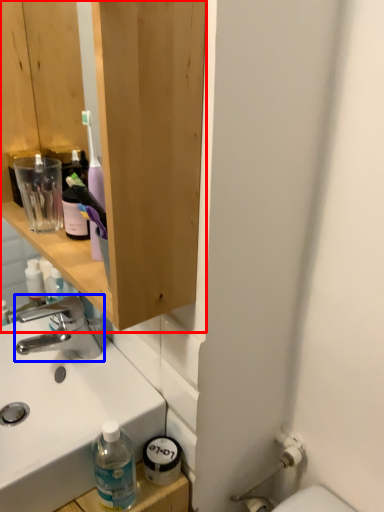
Question: Among these objects, which one is farthest to the camera, bathroom cabinet (highlighted by a red box) or tap (highlighted by a blue box)?

Choices:
 (A) bathroom cabinet
 (B) tap

Answer: (B)